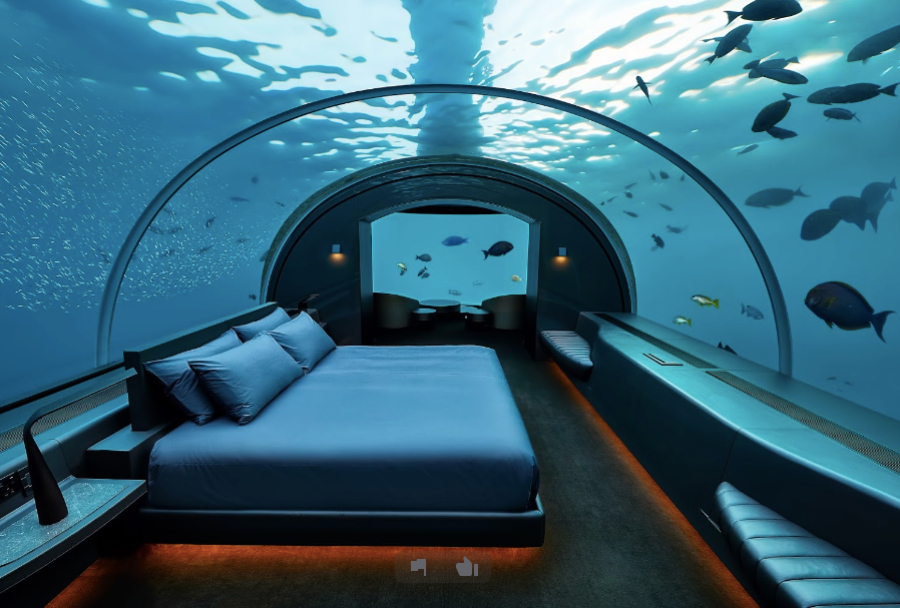
In order to click on window in this screenshot , I will do `click(465, 267)`, `click(423, 44)`.